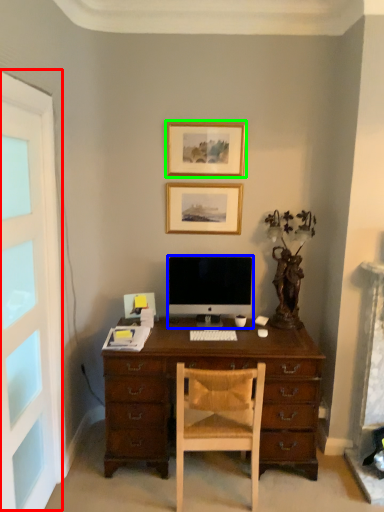
Question: Which object is positioned farthest from screen door (highlighted by a red box)? Select from computer monitor (highlighted by a blue box) and picture frame (highlighted by a green box).

Choices:
 (A) computer monitor
 (B) picture frame

Answer: (B)